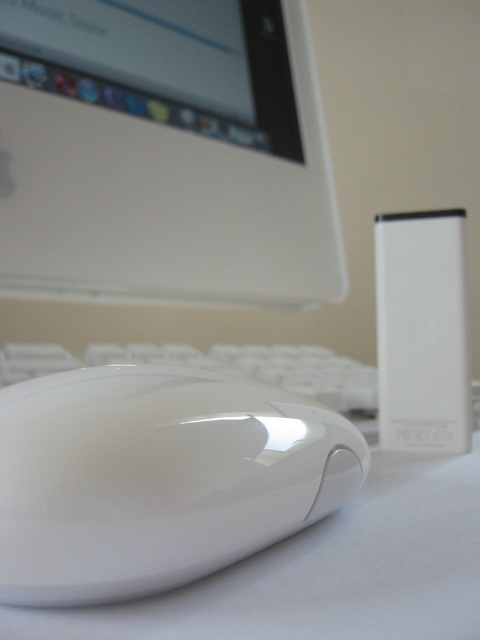
Question: Which object appears closest to the camera in this image?

Choices:
 (A) white glossy computer monitor at upper left
 (B) white matte keyboard at center

Answer: (B)

Question: Which object appears farthest from the camera in this image?

Choices:
 (A) white glossy mouse at center
 (B) white glossy computer monitor at upper left

Answer: (B)

Question: Which of the following is the farthest from the observer?

Choices:
 (A) white glossy computer monitor at upper left
 (B) white glossy mouse at center

Answer: (A)

Question: Is white glossy computer monitor at upper left above white matte keyboard at center?

Choices:
 (A) no
 (B) yes

Answer: (B)

Question: Does white glossy mouse at center appear under white matte keyboard at center?

Choices:
 (A) yes
 (B) no

Answer: (B)

Question: Is white glossy computer monitor at upper left closer to camera compared to white matte keyboard at center?

Choices:
 (A) no
 (B) yes

Answer: (A)